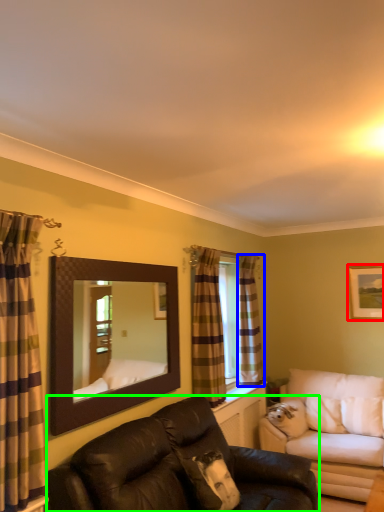
Question: Estimate the real-world distances between objects in this image. Which object is farther from picture frame (highlighted by a red box), curtain (highlighted by a blue box) or studio couch (highlighted by a green box)?

Choices:
 (A) curtain
 (B) studio couch

Answer: (B)